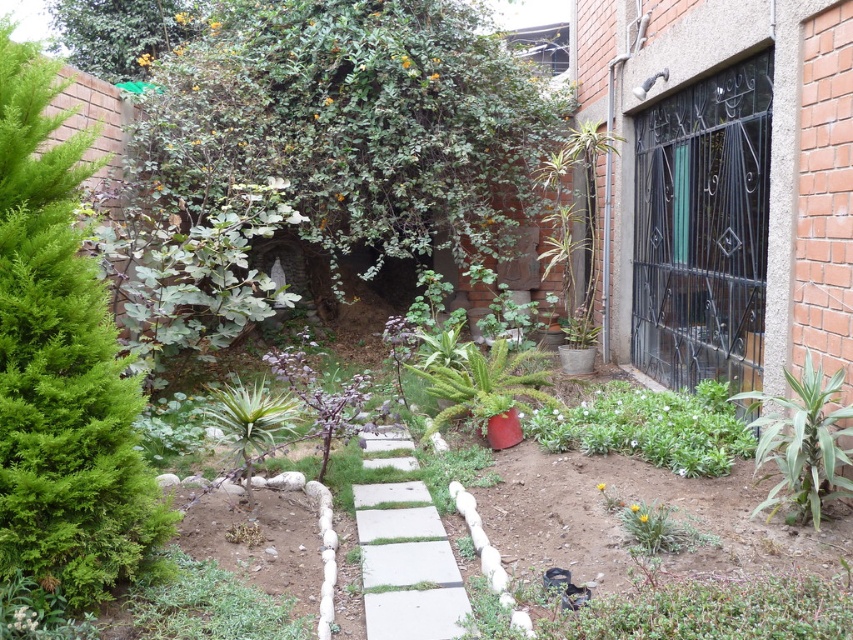
Question: Which object is positioned farthest from the green leafy plant at right?

Choices:
 (A) concrete at center
 (B) green leafy bush at upper center

Answer: (B)

Question: Is green leafy bush at upper center bigger than green leafy plant at lower center?

Choices:
 (A) no
 (B) yes

Answer: (B)

Question: Is green leafy bush at left behind concrete at center?

Choices:
 (A) yes
 (B) no

Answer: (B)

Question: Which of the following is the farthest from the observer?

Choices:
 (A) (202, 612)
 (B) (36, 372)

Answer: (A)

Question: Which point is farther to the camera?

Choices:
 (A) (851, 412)
 (B) (553, 445)
 (C) (363, 524)
 (D) (183, 588)

Answer: (B)

Question: Can you confirm if green leafy bush at left is positioned to the right of green leafy plant at right?

Choices:
 (A) yes
 (B) no

Answer: (B)